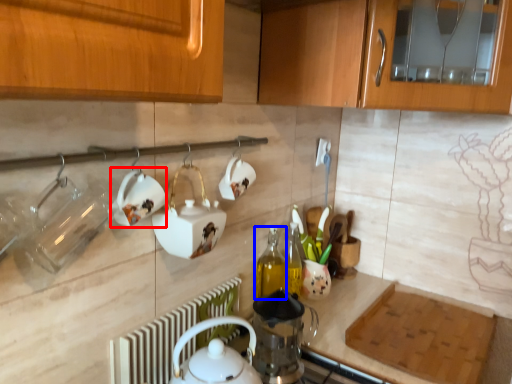
Question: Which object is closer to the camera taking this photo, tableware (highlighted by a red box) or bottle (highlighted by a blue box)?

Choices:
 (A) tableware
 (B) bottle

Answer: (A)